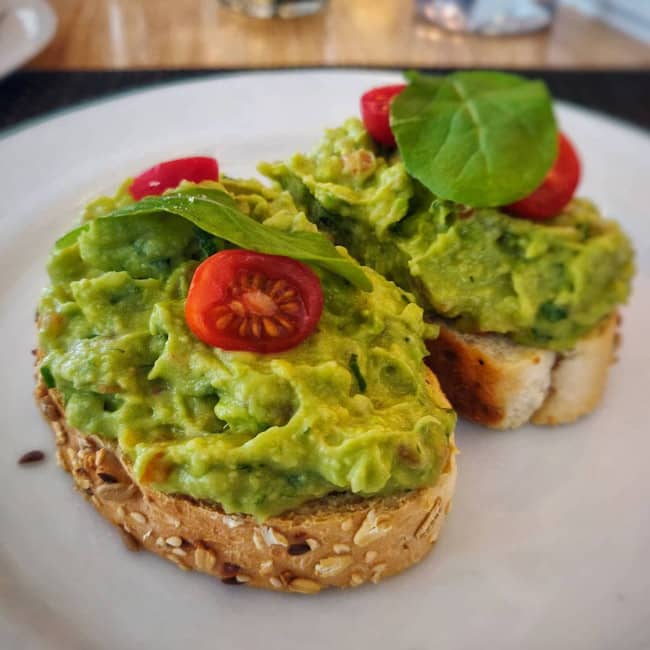
Where is `seed on plate`? seed on plate is located at coordinates (32, 457).